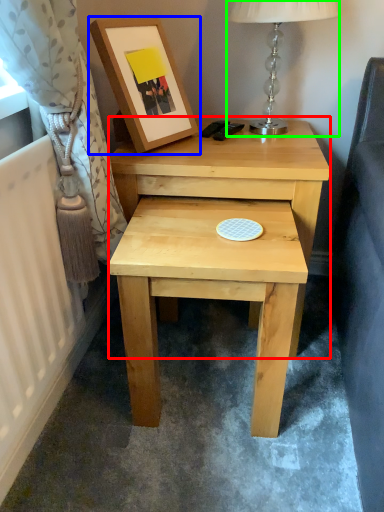
Question: Considering the real-world distances, which object is closest to nightstand (highlighted by a red box)? picture frame (highlighted by a blue box) or table lamp (highlighted by a green box).

Choices:
 (A) picture frame
 (B) table lamp

Answer: (A)